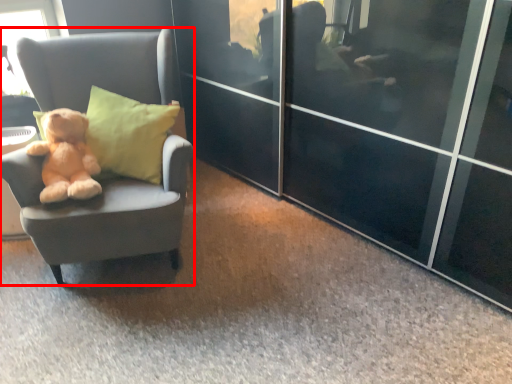
Question: Where is chair (annotated by the red box) located in relation to teddy bear in the image?

Choices:
 (A) left
 (B) right

Answer: (B)